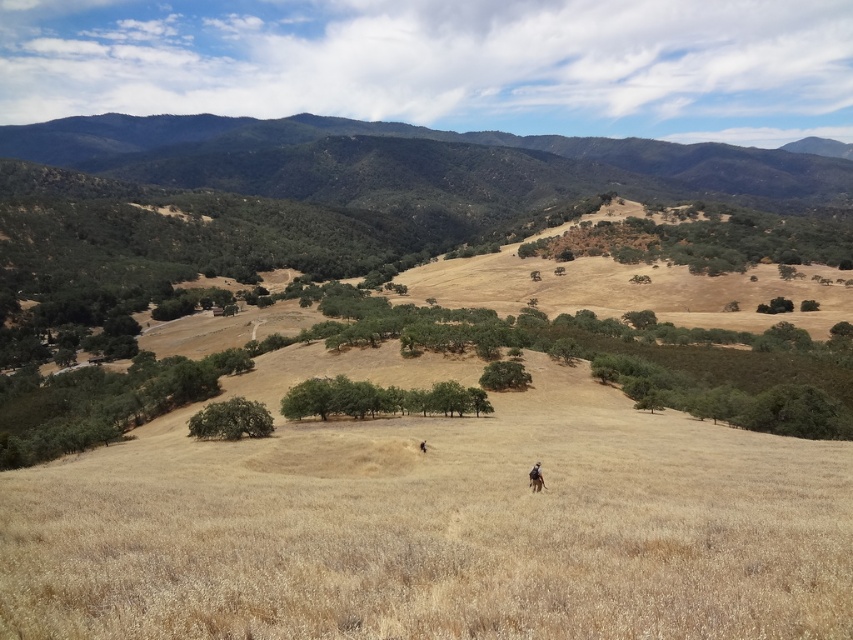
Describe the element at coordinates (378, 397) in the screenshot. I see `green leafy trees at center` at that location.

Locate an element on the screen. The image size is (853, 640). green leafy trees at center is located at coordinates (378, 397).

The width and height of the screenshot is (853, 640). In order to click on green leafy trees at center in this screenshot , I will do `click(378, 397)`.

Does green matte tree at center-left have a lesser height compared to brown leather backpack at center?

No, green matte tree at center-left is not shorter than brown leather backpack at center.

Is the position of green matte tree at center-left more distant than that of brown leather backpack at center?

That is True.

Locate an element on the screen. The width and height of the screenshot is (853, 640). green matte tree at center-left is located at coordinates (231, 419).

Does point (193, 429) lie in front of point (425, 451)?

No, it is behind (425, 451).

Does point (223, 403) lie behind point (421, 445)?

Yes, it is.

What are the coordinates of `green matte tree at center-left` in the screenshot? It's located at pyautogui.click(x=231, y=419).